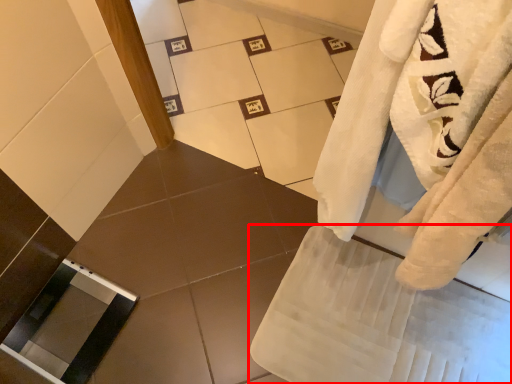
Question: From the image's perspective, where is bath towel (annotated by the red box) located relative to screen door?

Choices:
 (A) below
 (B) above

Answer: (A)